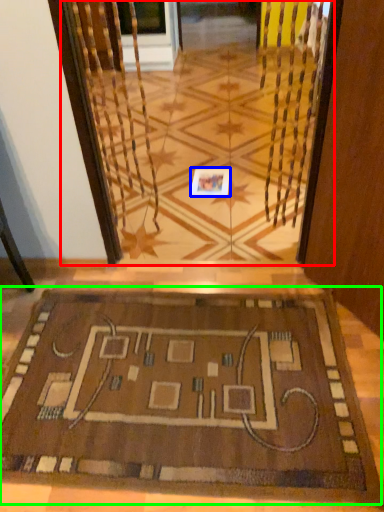
Question: Which object is positioned farthest from glass door (highlighted by a red box)? Select from square (highlighted by a blue box) and mat (highlighted by a green box).

Choices:
 (A) square
 (B) mat

Answer: (B)